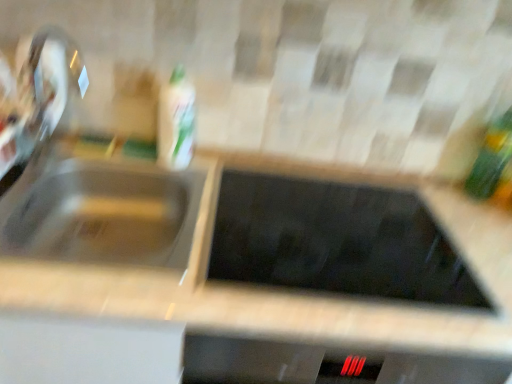
The width and height of the screenshot is (512, 384). I want to click on vacant space that is to the left of green glass bottle at right, the 2th bottle positioned from the left, so click(x=424, y=187).